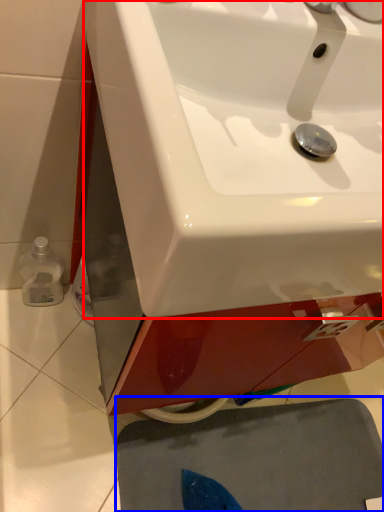
Question: Which object is closer to the camera taking this photo, sink (highlighted by a red box) or bath mat (highlighted by a blue box)?

Choices:
 (A) sink
 (B) bath mat

Answer: (A)